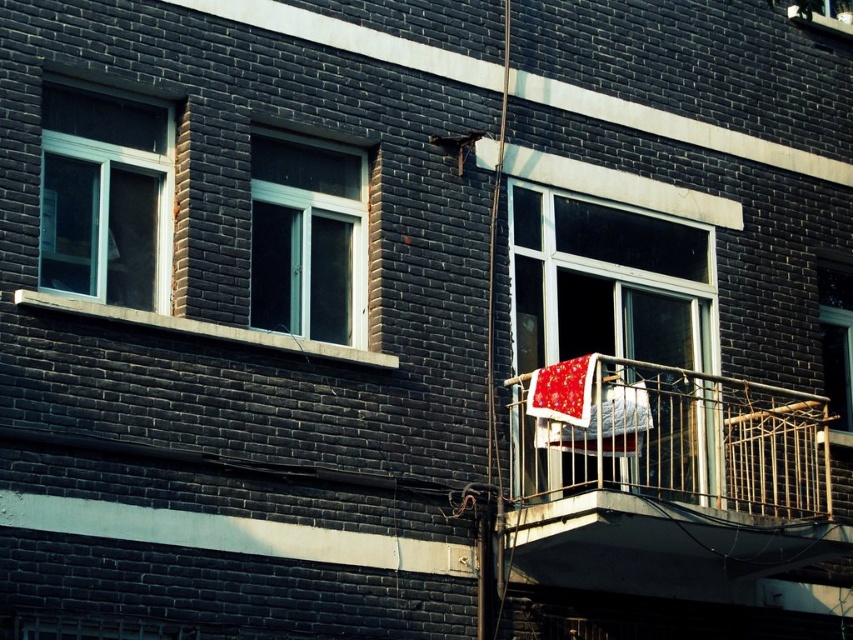
Question: Which of these objects is positioned closest to the transparent glass window at upper right?

Choices:
 (A) white plastic window at center
 (B) metallic railing at right
 (C) clear glass window at upper left
 (D) clear glass window at center

Answer: (D)

Question: Which object is the closest to the metallic railing at right?

Choices:
 (A) transparent glass window at upper right
 (B) white plastic window at center
 (C) clear glass window at center
 (D) clear glass window at upper left

Answer: (C)

Question: Can you confirm if metallic railing at right is bigger than white plastic window at center?

Choices:
 (A) no
 (B) yes

Answer: (B)

Question: Does metallic railing at right appear on the left side of clear glass window at center?

Choices:
 (A) yes
 (B) no

Answer: (B)

Question: Is clear glass window at upper left to the left of transparent glass window at upper right from the viewer's perspective?

Choices:
 (A) yes
 (B) no

Answer: (A)

Question: Which point is farther to the camera?

Choices:
 (A) (848, 312)
 (B) (293, 289)

Answer: (A)